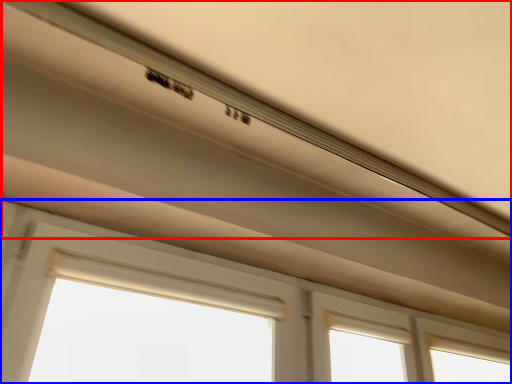
Question: Which point is further to the camera, exhaust hood (highlighted by a red box) or window (highlighted by a blue box)?

Choices:
 (A) exhaust hood
 (B) window

Answer: (B)